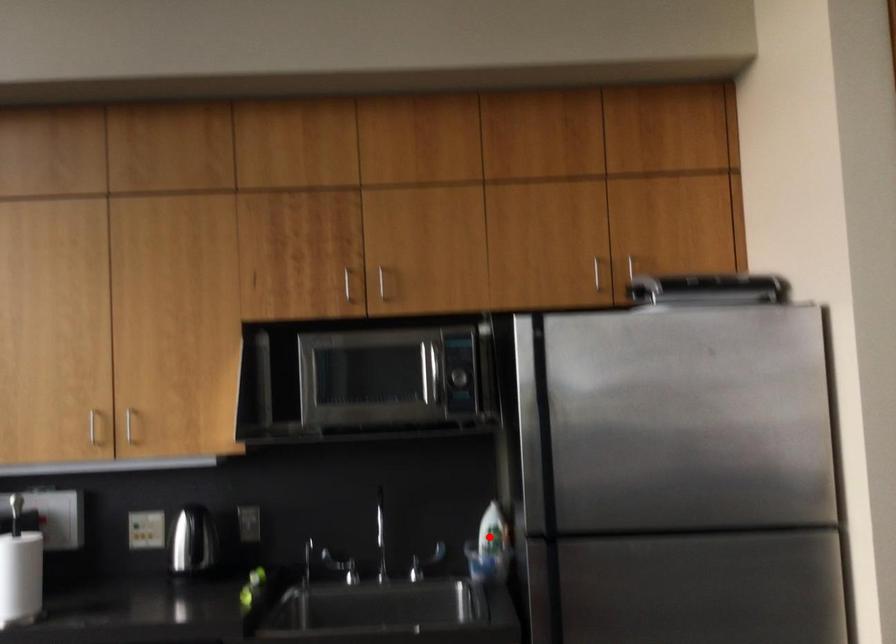
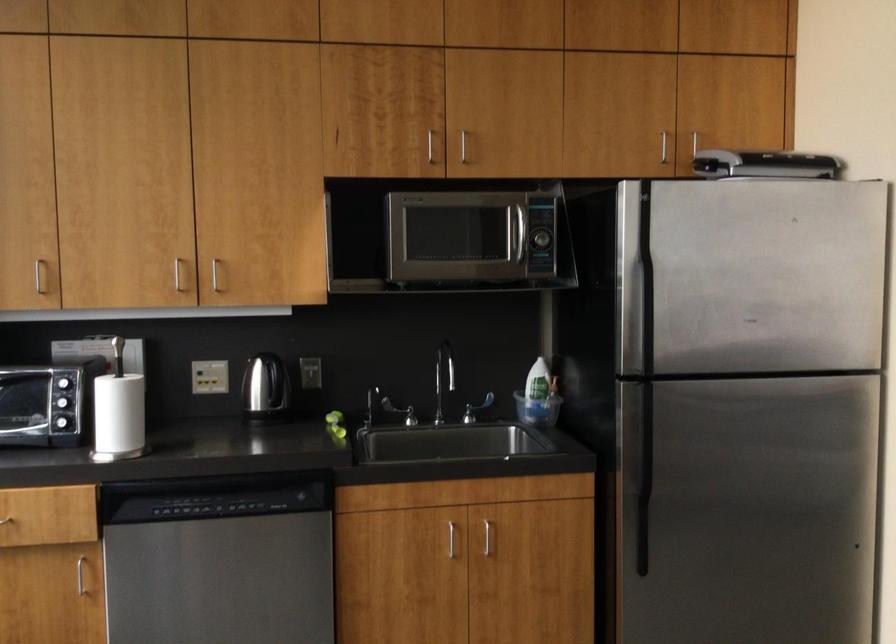
Find the pixel in the second image that matches the highlighted location in the first image.

(539, 391)